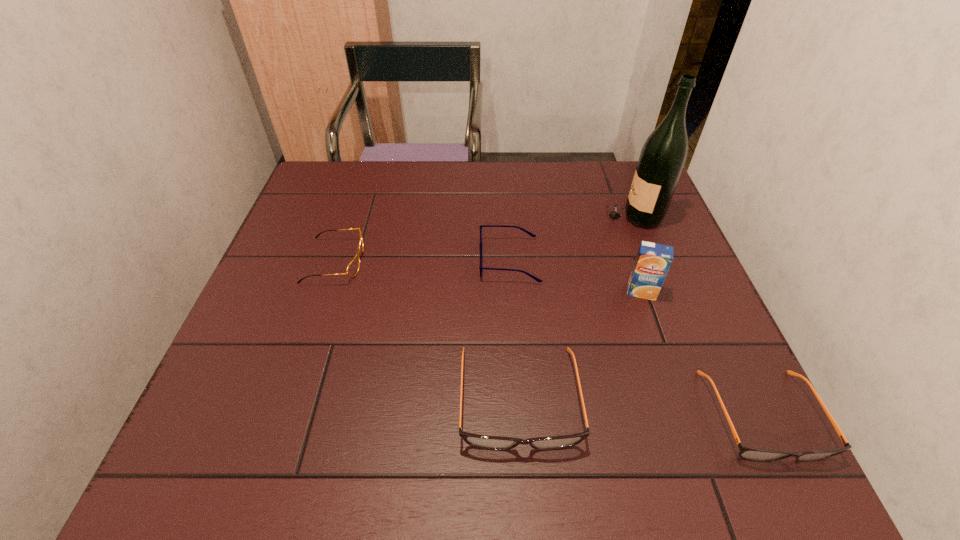
I want to click on vacant spot to place a spectacles on the left, so click(x=290, y=381).